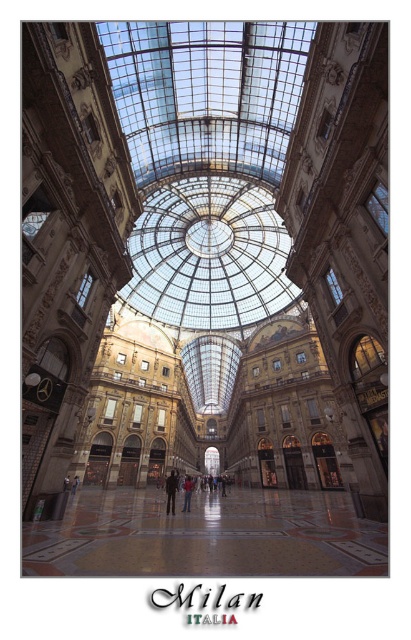
Is polished marble floor at center wider than transparent glass dome at center?

Indeed, polished marble floor at center has a greater width compared to transparent glass dome at center.

Between polished marble floor at center and transparent glass dome at center, which one has more height?

Standing taller between the two is transparent glass dome at center.

Which is in front, point (290, 513) or point (163, 205)?

Point (290, 513)

At what (x,y) coordinates should I click in order to perform the action: click on polished marble floor at center. Please return your answer as a coordinate pair (x, y). The height and width of the screenshot is (640, 411). Looking at the image, I should click on (207, 536).

Does polished marble floor at center appear over dark brown leather jacket at center?

Correct, polished marble floor at center is located above dark brown leather jacket at center.

Between polished marble floor at center and dark brown leather jacket at center, which one appears on the left side from the viewer's perspective?

dark brown leather jacket at center

Is point (71, 548) farther from viewer compared to point (173, 480)?

No, it is not.

Locate an element on the screen. This screenshot has width=411, height=640. polished marble floor at center is located at coordinates (207, 536).

Is dark brown leather jacket at center wider than red fabric jacket at center?

Correct, the width of dark brown leather jacket at center exceeds that of red fabric jacket at center.

Is dark brown leather jacket at center taller than red fabric jacket at center?

Correct, dark brown leather jacket at center is much taller as red fabric jacket at center.

The height and width of the screenshot is (640, 411). I want to click on dark brown leather jacket at center, so click(x=170, y=492).